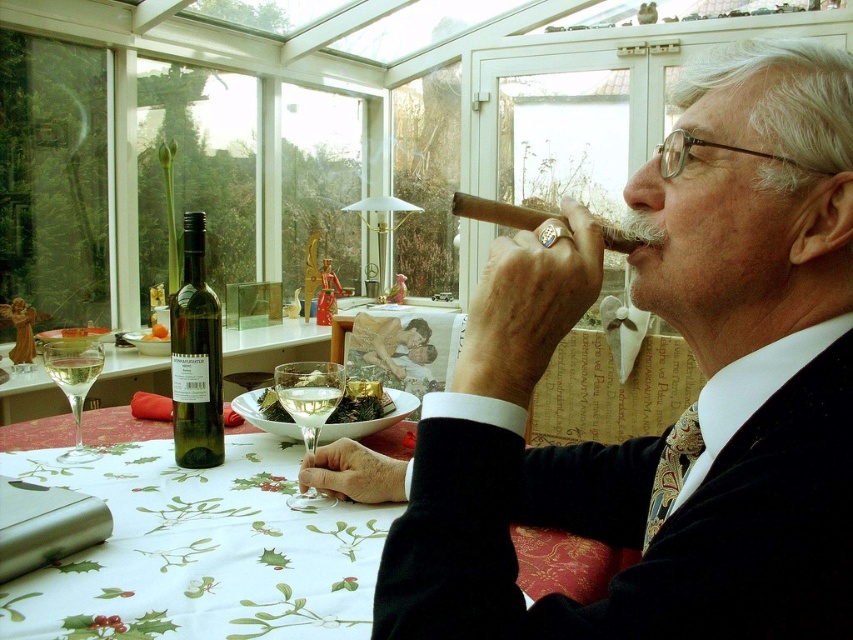
Question: Is smooth brown cigar at upper right smaller than clear glass wine at table left?

Choices:
 (A) yes
 (B) no

Answer: (B)

Question: Which is nearer to the clear glass wine at table left?

Choices:
 (A) green glass bottle at left
 (B) smooth brown cigar at upper right
 (C) clear glass wine at table center

Answer: (A)

Question: Is clear glass wine glass at center above clear glass wine glass at lower left?

Choices:
 (A) no
 (B) yes

Answer: (A)

Question: Estimate the real-world distances between objects in this image. Which object is farther from the clear glass wine glass at center?

Choices:
 (A) clear glass wine glass at lower left
 (B) smooth brown cigar at upper right

Answer: (B)

Question: Which is farther from the smooth brown cigar at upper right?

Choices:
 (A) clear glass wine glass at lower left
 (B) green glass bottle at left

Answer: (A)

Question: Is clear glass wine glass at lower left positioned before clear glass wine at table center?

Choices:
 (A) no
 (B) yes

Answer: (A)